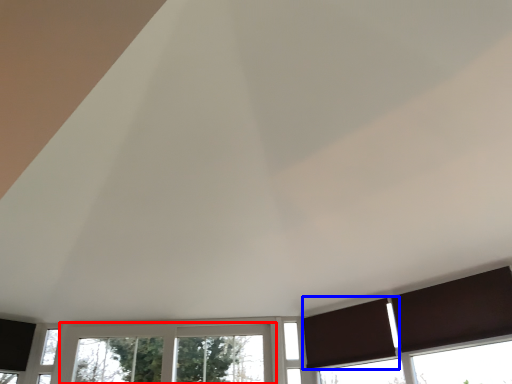
Question: Among these objects, which one is farthest to the camera, window (highlighted by a red box) or curtain (highlighted by a blue box)?

Choices:
 (A) window
 (B) curtain

Answer: (A)